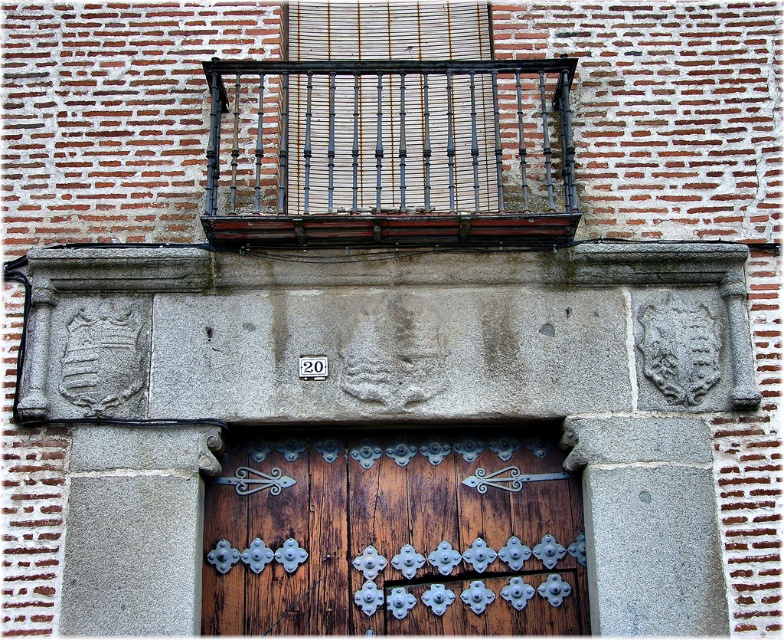
Question: Can you confirm if rusty metal balcony at upper center is positioned above wooden slats at center?

Choices:
 (A) yes
 (B) no

Answer: (B)

Question: Which point is closer to the camera taking this photo?

Choices:
 (A) (552, 528)
 (B) (481, 29)
 (C) (383, 204)

Answer: (A)

Question: Is wooden door with metal hinges at center smaller than rusty metal balcony at upper center?

Choices:
 (A) no
 (B) yes

Answer: (A)

Question: Among these points, which one is nearest to the camera?

Choices:
 (A) (394, 241)
 (B) (365, 58)
 (C) (456, 436)

Answer: (A)

Question: Which object is farther from the camera taking this photo?

Choices:
 (A) rusty metal balcony at upper center
 (B) wooden slats at center

Answer: (B)

Question: Does wooden door with metal hinges at center come in front of rusty metal balcony at upper center?

Choices:
 (A) no
 (B) yes

Answer: (B)